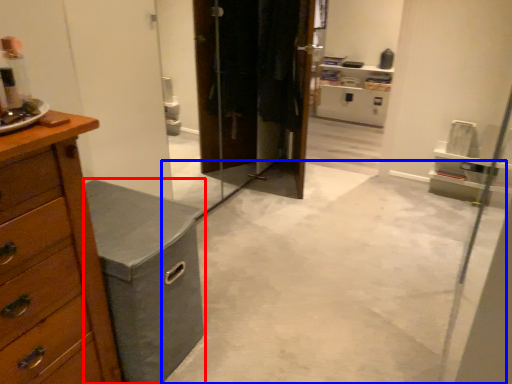
Question: Which of the following is the farthest to the observer, vanity (highlighted by a red box) or concrete (highlighted by a blue box)?

Choices:
 (A) vanity
 (B) concrete

Answer: (A)